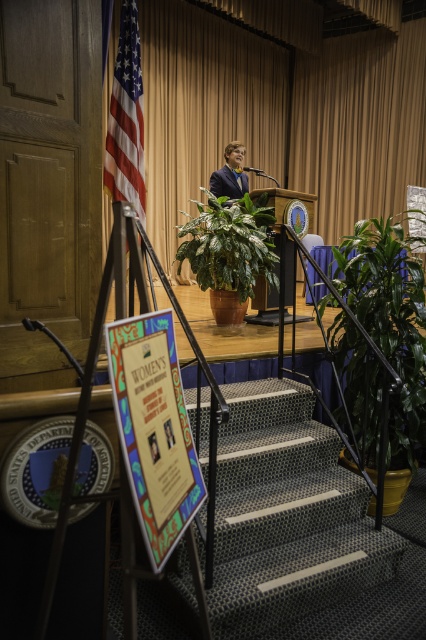
Question: Can you confirm if green carpeted stairs at center is positioned to the right of green glossy plant at center?

Choices:
 (A) yes
 (B) no

Answer: (A)

Question: Where is matte gold curtain at upper center located in relation to green leafy plant at center in the image?

Choices:
 (A) right
 (B) left

Answer: (B)

Question: Is green leafy plant at center positioned in front of matte blue suit at center?

Choices:
 (A) no
 (B) yes

Answer: (B)

Question: Estimate the real-world distances between objects in this image. Which object is farther from the matte gold curtain at upper center?

Choices:
 (A) green carpeted stairs at center
 (B) red-white-striped flag at left
 (C) green glossy plant at center
 (D) matte blue suit at center

Answer: (A)

Question: Considering the real-world distances, which object is farthest from the matte blue suit at center?

Choices:
 (A) green leafy plant at center
 (B) green carpeted stairs at center

Answer: (B)

Question: Which of the following is the closest to the observer?

Choices:
 (A) green carpeted stairs at center
 (B) matte blue suit at center

Answer: (A)